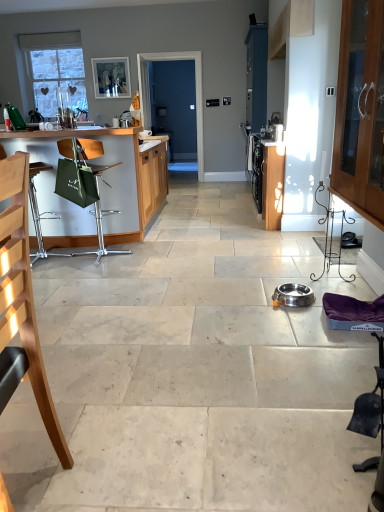
This screenshot has width=384, height=512. I want to click on vacant space in black fabric swivel chair at lower right (from a real-world perspective), so click(366, 463).